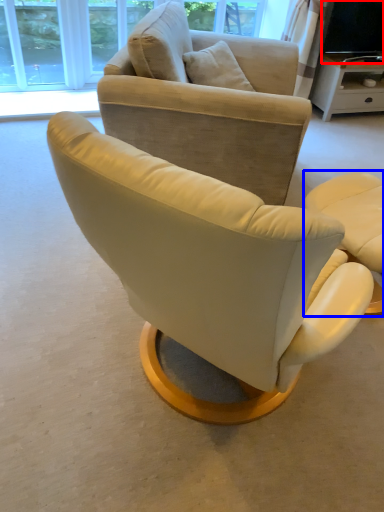
Question: Which object appears farthest to the camera in this image, television (highlighted by a red box) or chair (highlighted by a blue box)?

Choices:
 (A) television
 (B) chair

Answer: (A)